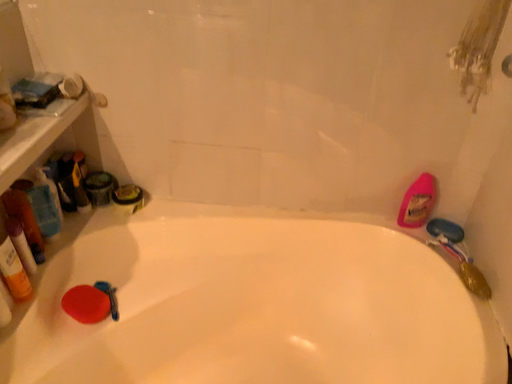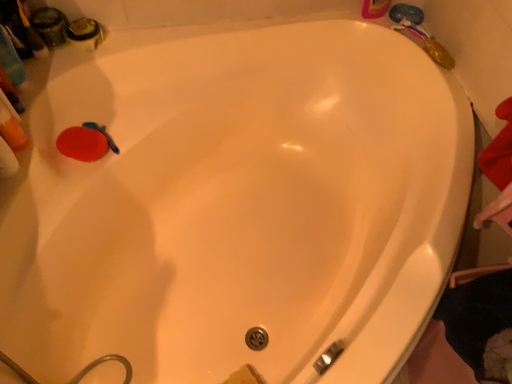
Question: How did the camera likely rotate when shooting the video?

Choices:
 (A) rotated right
 (B) rotated left

Answer: (A)